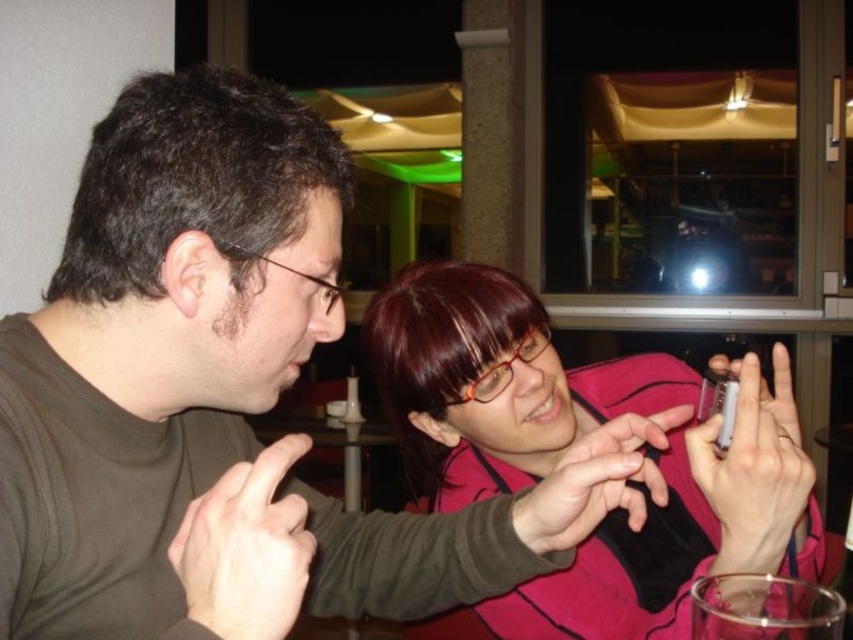
You are a photographer trying to capture a candid shot of the two people in the scene. You want to ensure that the pink matte jacket at center is visible in the frame without blocking the wooden table at center. Based on their positions, is this possible?

The pink matte jacket at center is located above the wooden table at center, so it is possible to capture the jacket in the frame while keeping the table visible below it without obstruction.

You are a photographer trying to capture a candid shot of the two people in the scene. Since you want to ensure the pink matte jacket at center and the wooden table at center are both visible in the frame, which object should you position closer to the camera?

The pink matte jacket at center is in front of the wooden table at center, so to ensure both are visible, position the pink matte jacket at center closer to the camera to avoid it blocking the wooden table at center.

You are designing a new coat rack for the room where the pink matte jacket at center and wooden table at center are located. Considering their sizes, which object should be placed closer to the entrance to ensure there is enough space for both?

The pink matte jacket at center has a smaller size compared to wooden table at center, so the wooden table at center should be placed closer to the entrance to allow more space for the larger object.